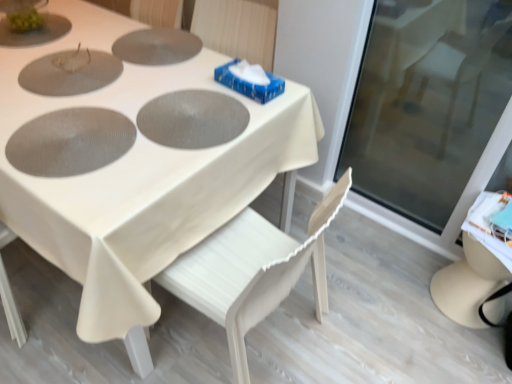
I want to click on free spot above gray matte pizza pan at center, which is the second pizza pan in back-to-front order (from a real-world perspective), so click(192, 109).